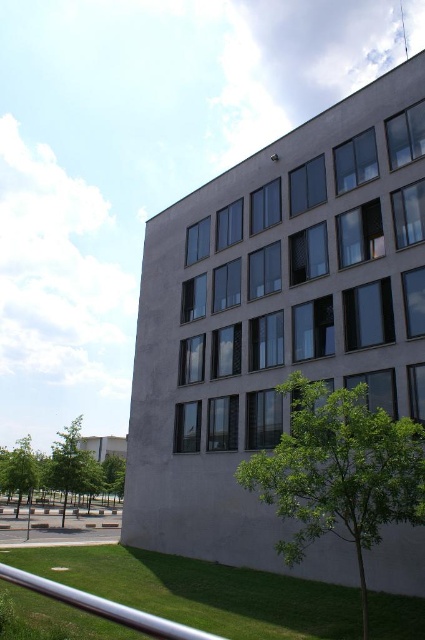
From the picture: Can you confirm if green grass at lower left is smaller than green leafy tree at center?

No, green grass at lower left is not smaller than green leafy tree at center.

At what (x,y) coordinates should I click in order to perform the action: click on green grass at lower left. Please return your answer as a coordinate pair (x, y). This screenshot has width=425, height=640. Looking at the image, I should click on (201, 592).

At what (x,y) coordinates should I click in order to perform the action: click on green grass at lower left. Please return your answer as a coordinate pair (x, y). Image resolution: width=425 pixels, height=640 pixels. Looking at the image, I should click on pos(201,592).

Is green grass at lower left below green leafy tree at lower left?

Actually, green grass at lower left is above green leafy tree at lower left.

Who is lower down, green grass at lower left or green leafy tree at lower left?

green leafy tree at lower left

This screenshot has width=425, height=640. In order to click on green grass at lower left in this screenshot , I will do pos(201,592).

Does green leafy tree at center have a greater width compared to green leafy tree at lower left?

No.

Is green leafy tree at center thinner than green leafy tree at lower left?

Indeed, green leafy tree at center has a lesser width compared to green leafy tree at lower left.

Between point (362, 385) and point (81, 493), which one is positioned behind?

Positioned behind is point (81, 493).

Where is `green leafy tree at center`? This screenshot has height=640, width=425. green leafy tree at center is located at coordinates (340, 472).